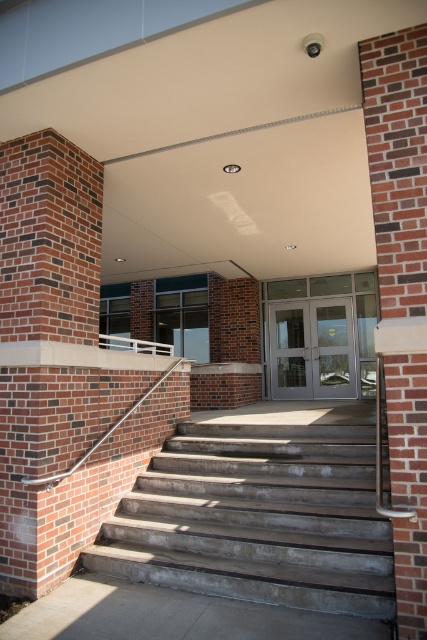
Consider the image. Between brick column at left and brick at right, which one is positioned lower?

brick column at left

Between point (84, 168) and point (417, 67), which one is positioned behind?

The point (84, 168) is behind.

Is point (56, 426) more distant than point (403, 464)?

Yes, point (56, 426) is farther from viewer.

At what (x,y) coordinates should I click in order to perform the action: click on brick column at left. Please return your answer as a coordinate pair (x, y). Image resolution: width=427 pixels, height=640 pixels. Looking at the image, I should click on (64, 369).

Can you confirm if concrete/stained at center is wider than white plastic rail at upper center?

Yes.

Based on the photo, measure the distance from concrete/stained at center to white plastic rail at upper center.

concrete/stained at center and white plastic rail at upper center are 7.10 meters apart from each other.

Describe the element at coordinates (257, 518) in the screenshot. I see `concrete/stained at center` at that location.

Where is `concrete/stained at center`? The image size is (427, 640). concrete/stained at center is located at coordinates (257, 518).

Between brick column at left and satin silver railing at left, which one is positioned higher?

brick column at left

Consider the image. How much distance is there between brick column at left and satin silver railing at left?

brick column at left and satin silver railing at left are 35.29 inches apart from each other.

This screenshot has width=427, height=640. What do you see at coordinates (64, 369) in the screenshot?
I see `brick column at left` at bounding box center [64, 369].

You are a GUI agent. You are given a task and a screenshot of the screen. Output one action in this format:
    pyautogui.click(x=<x>, y=<y>)
    Task: Click on the brick column at left
    This screenshot has height=640, width=427.
    Given the screenshot: What is the action you would take?
    pyautogui.click(x=64, y=369)